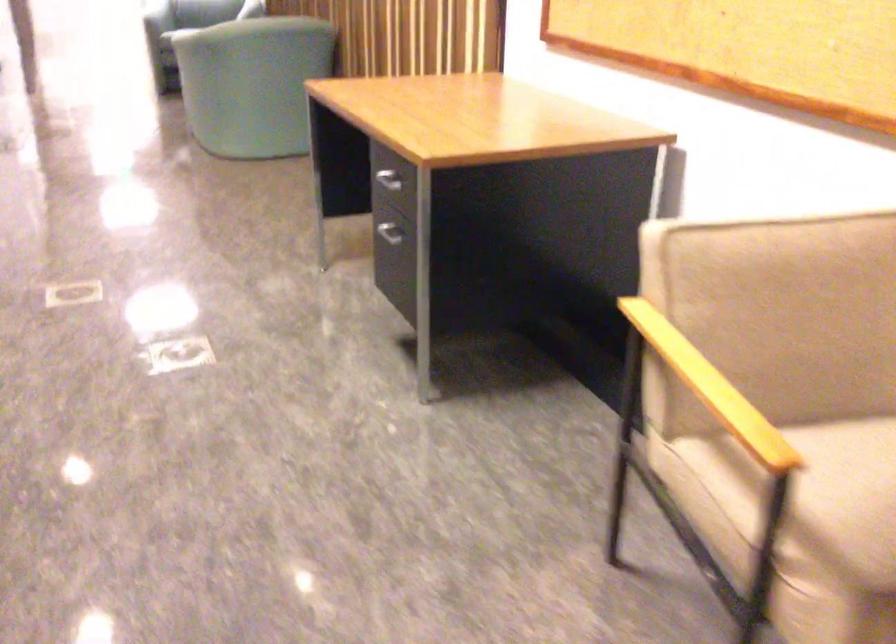
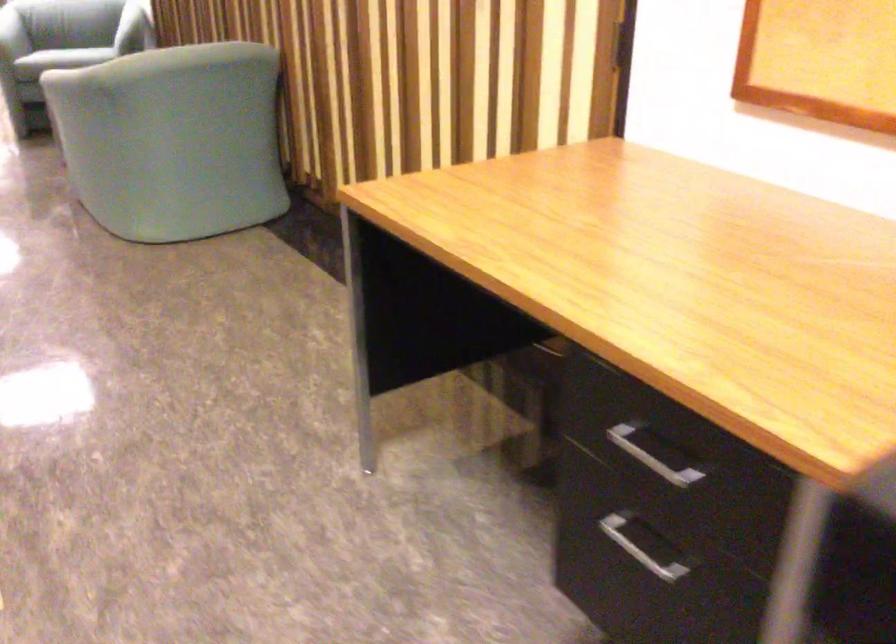
In a continuous first-person perspective shot, in which direction is the camera moving?

The cameraman walked toward left, forward.